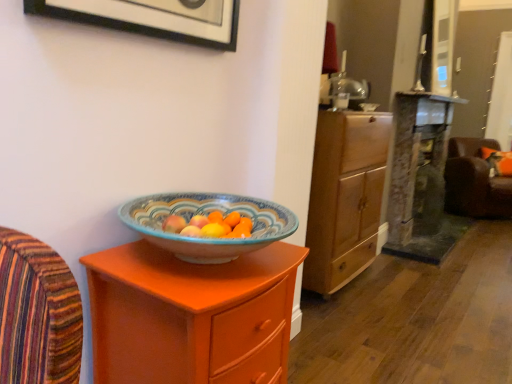
Question: Is matte orange cabinet at center in front of or behind brown leather swivel chair at right in the image?

Choices:
 (A) front
 (B) behind

Answer: (A)

Question: Is point (150, 248) closer or farther from the camera than point (495, 201)?

Choices:
 (A) farther
 (B) closer

Answer: (B)

Question: Which object is positioned closest to the matte orange cabinet at center?

Choices:
 (A) wooden cabinet at center
 (B) orange fabric pillow at right
 (C) brown leather swivel chair at right
 (D) matte black picture frame at upper left

Answer: (D)

Question: Which object is positioned farthest from the matte black picture frame at upper left?

Choices:
 (A) matte orange cabinet at center
 (B) wooden cabinet at center
 (C) orange fabric pillow at right
 (D) brown leather swivel chair at right

Answer: (C)